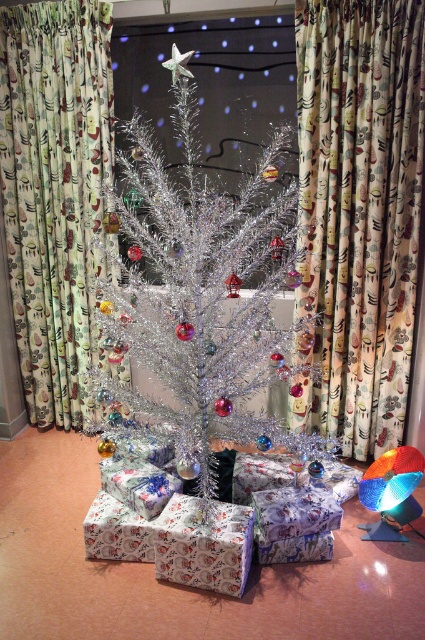
Can you confirm if floral fabric curtain at center is taller than shiny metallic tree at center?

Yes.

Does floral fabric curtain at center appear on the left side of shiny metallic tree at center?

No, floral fabric curtain at center is not to the left of shiny metallic tree at center.

Where is `floral fabric curtain at center`? floral fabric curtain at center is located at coordinates (359, 211).

You are a GUI agent. You are given a task and a screenshot of the screen. Output one action in this format:
    pyautogui.click(x=<x>, y=<y>)
    Task: Click on the floral fabric curtain at center
    
    Given the screenshot: What is the action you would take?
    pyautogui.click(x=359, y=211)

This screenshot has width=425, height=640. I want to click on shiny metallic tree at center, so click(x=200, y=294).

Does shiny metallic tree at center appear under floral fabric curtain at left?

Correct, shiny metallic tree at center is located below floral fabric curtain at left.

Find the location of a particular element. This screenshot has width=425, height=640. shiny metallic tree at center is located at coordinates (200, 294).

Does floral fabric curtain at center have a smaller size compared to floral fabric curtain at left?

Yes.

Is floral fabric curtain at center in front of floral fabric curtain at left?

Yes, floral fabric curtain at center is in front of floral fabric curtain at left.

Locate an element on the screen. The image size is (425, 640). floral fabric curtain at center is located at coordinates (359, 211).

You are a GUI agent. You are given a task and a screenshot of the screen. Output one action in this format:
    pyautogui.click(x=<x>, y=<y>)
    Task: Click on the floral fabric curtain at center
    
    Given the screenshot: What is the action you would take?
    pyautogui.click(x=359, y=211)